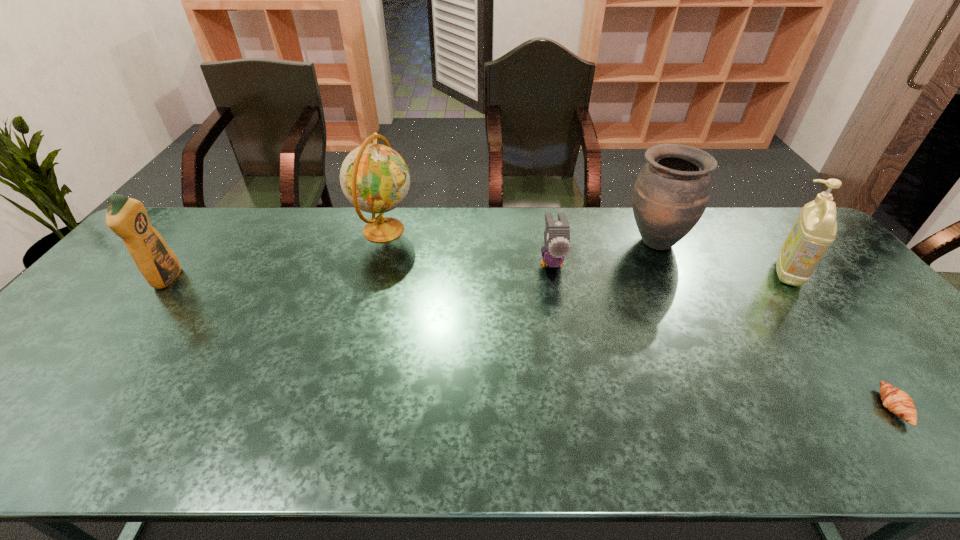
Locate an element on the screen. free area in between the second object from left to right and the right detergent is located at coordinates point(587,251).

The image size is (960, 540). What are the coordinates of `vacant area that lies between the second shortest object and the pastry` in the screenshot? It's located at (722, 335).

Find the location of `vacant area between the fifth tallest object and the right detergent`. vacant area between the fifth tallest object and the right detergent is located at coordinates (670, 267).

This screenshot has height=540, width=960. Identify the location of vacant point located between the left detergent and the right detergent. (477, 275).

The width and height of the screenshot is (960, 540). I want to click on vacant area that lies between the urn and the second object from left to right, so click(x=519, y=235).

Where is `vacant space that is in between the left detergent and the bird`? This screenshot has height=540, width=960. vacant space that is in between the left detergent and the bird is located at coordinates (359, 271).

Find the location of a particular element. This screenshot has width=960, height=540. empty space between the third object from right to left and the right detergent is located at coordinates (722, 257).

Where is `vacant point located between the leftmost object and the third object from right to left`? The image size is (960, 540). vacant point located between the leftmost object and the third object from right to left is located at coordinates (411, 260).

This screenshot has height=540, width=960. In order to click on object that is the third closest to the right detergent in this screenshot , I will do `click(557, 233)`.

What are the coordinates of `the fourth closest object relative to the nearest object` in the screenshot? It's located at (374, 178).